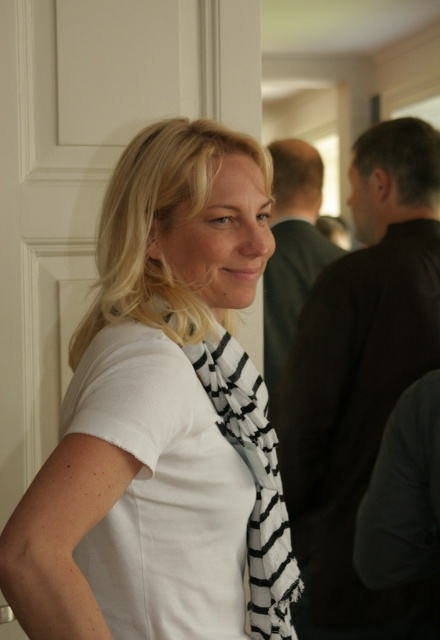
Does point (385, 125) lie in front of point (245, 413)?

No.

Who is more distant from viewer, [315,392] or [266,621]?

The point [315,392] is behind.

Does point (301, 467) lie in front of point (275, 490)?

No, it is behind (275, 490).

This screenshot has height=640, width=440. I want to click on black matte vest at right, so click(x=360, y=380).

Is white matte scarf at center positioned in front of black and white striped scarf at center?

Yes, white matte scarf at center is closer to the viewer.

In the scene shown: Is white matte scarf at center above black and white striped scarf at center?

Yes, white matte scarf at center is above black and white striped scarf at center.

Find the location of a particular element. The width and height of the screenshot is (440, 640). white matte scarf at center is located at coordinates (162, 417).

Based on the photo, can you confirm if white matte scarf at center is positioned below black matte vest at right?

No.

Is point (41, 525) positioned in front of point (340, 348)?

That is True.

Identify the location of white matte scarf at center. (162, 417).